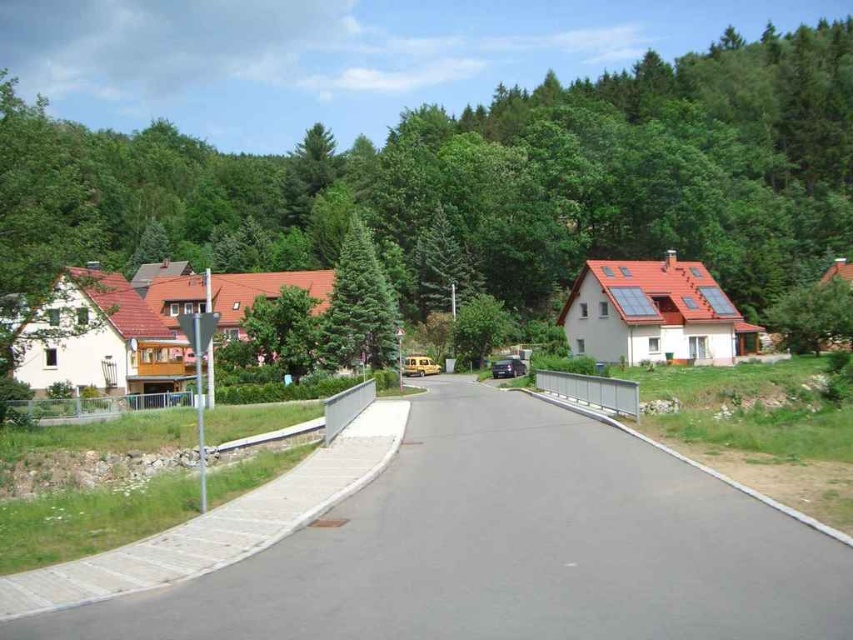
In the scene shown: Is green textured pine tree at center smaller than metallic silver car at center?

No.

Which is in front, point (361, 236) or point (491, 365)?

Point (361, 236) is in front.

Image resolution: width=853 pixels, height=640 pixels. Identify the location of green textured pine tree at center. (x=360, y=305).

Does green leafy tree at upper center lie in front of metallic silver car at center?

Yes.

Does green leafy tree at upper center have a lesser height compared to metallic silver car at center?

No.

Does point (605, 92) come closer to viewer compared to point (495, 369)?

No, (605, 92) is behind (495, 369).

Locate an element on the screen. green leafy tree at upper center is located at coordinates (476, 180).

Does green leafy tree at upper center have a greater width compared to green textured pine tree at center?

Indeed, green leafy tree at upper center has a greater width compared to green textured pine tree at center.

Which is below, green leafy tree at upper center or green textured pine tree at center?

Positioned lower is green textured pine tree at center.

Describe the element at coordinates (476, 180) in the screenshot. This screenshot has width=853, height=640. I see `green leafy tree at upper center` at that location.

What are the coordinates of `green leafy tree at upper center` in the screenshot? It's located at (476, 180).